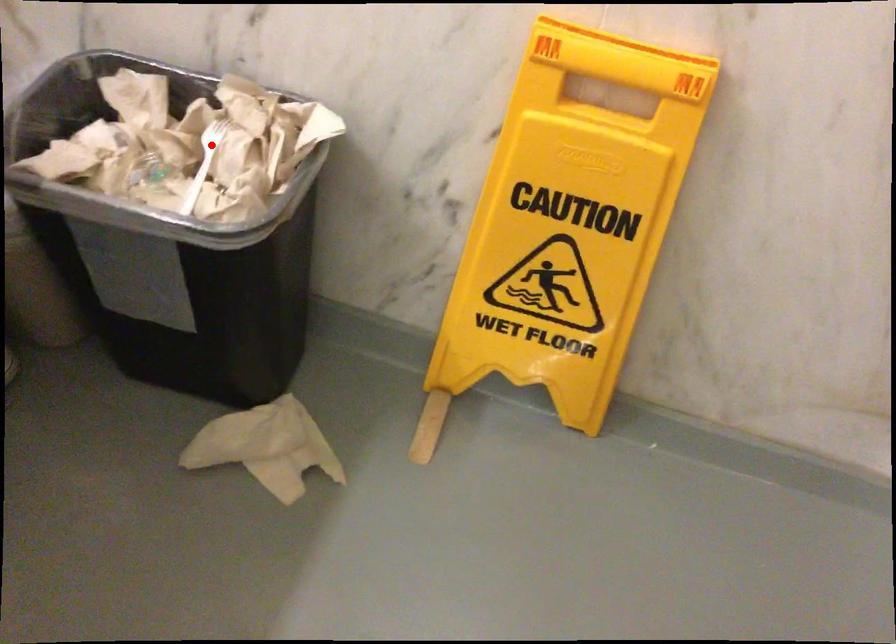
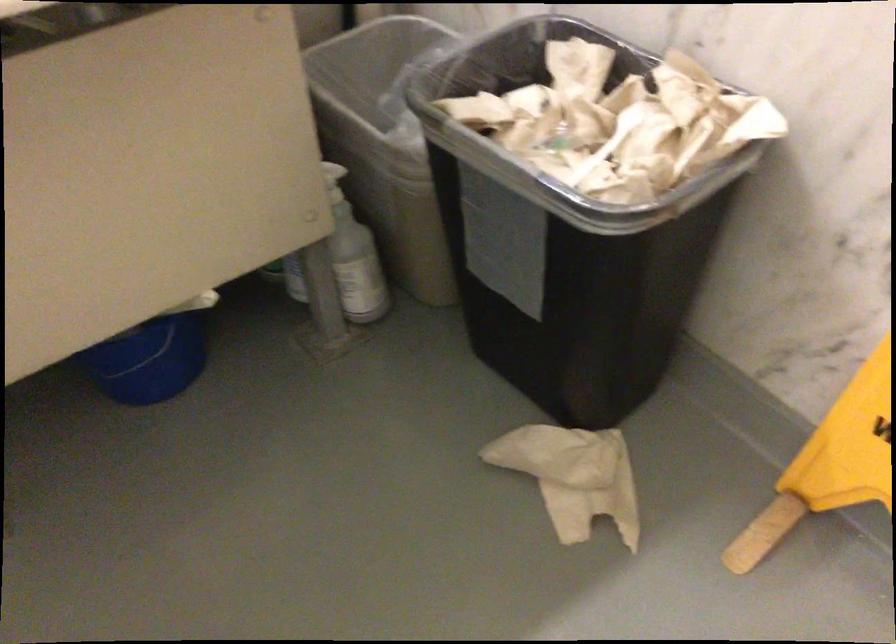
The point at the highlighted location is marked in the first image. Where is the corresponding point in the second image?

(618, 122)